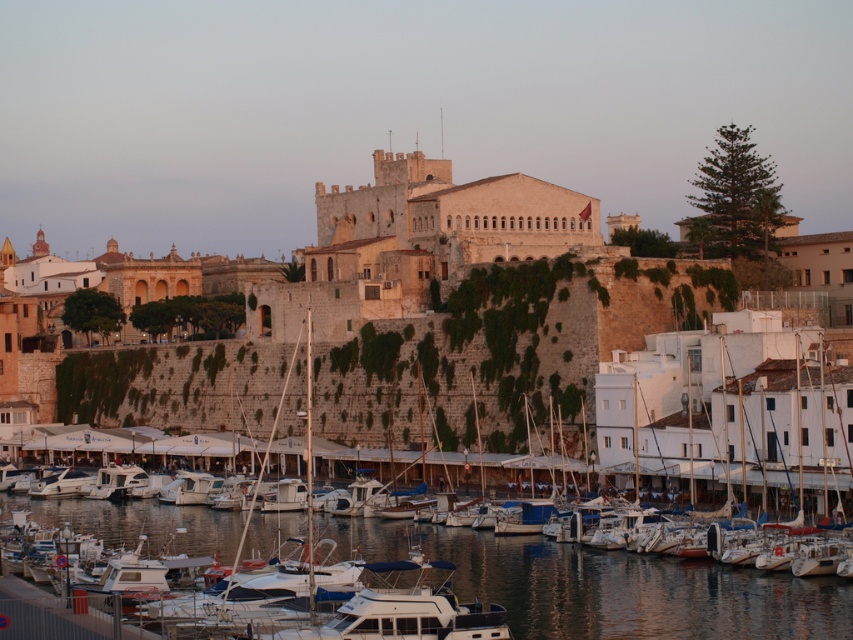
Question: Can you confirm if white matte sailboat at center is thinner than clear water at lower center?

Choices:
 (A) no
 (B) yes

Answer: (A)

Question: Is white matte sailboat at center closer to camera compared to clear water at lower center?

Choices:
 (A) no
 (B) yes

Answer: (A)

Question: Based on their relative distances, which object is farther from the clear water at lower center?

Choices:
 (A) stone wall at center
 (B) white matte sailboat at center

Answer: (A)

Question: Is stone wall at center above white matte sailboat at center?

Choices:
 (A) yes
 (B) no

Answer: (A)

Question: Which of the following is the closest to the observer?

Choices:
 (A) clear water at lower center
 (B) stone wall at center
 (C) white matte sailboat at center

Answer: (A)

Question: Which is nearer to the stone wall at center?

Choices:
 (A) white matte sailboat at center
 (B) clear water at lower center

Answer: (A)